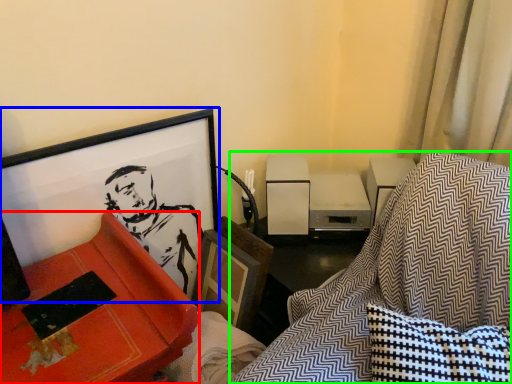
Question: Considering the real-world distances, which object is farthest from furniture (highlighted by a red box)? picture frame (highlighted by a blue box) or swivel chair (highlighted by a green box)?

Choices:
 (A) picture frame
 (B) swivel chair

Answer: (B)